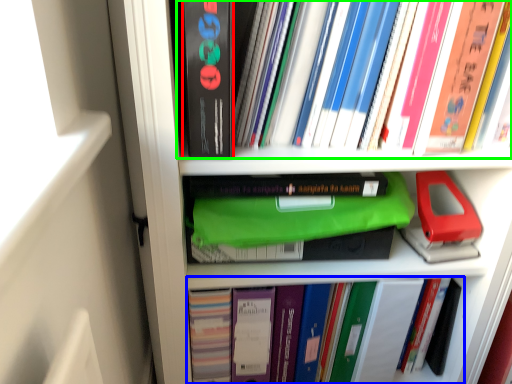
Question: Estimate the real-world distances between objects in this image. Which object is farther from paperback book (highlighted by a red box), book (highlighted by a blue box) or book (highlighted by a green box)?

Choices:
 (A) book
 (B) book

Answer: (A)